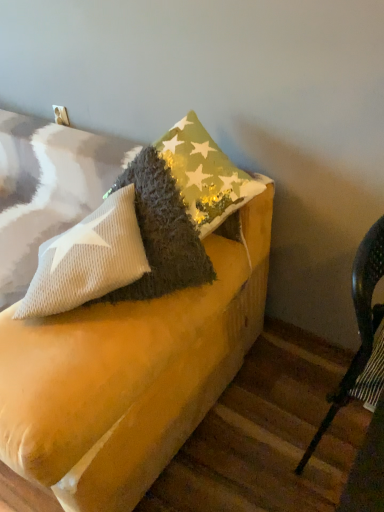
Question: In the image, is metallic dark green chair at right positioned in front of or behind velvet yellow couch at center?

Choices:
 (A) behind
 (B) front

Answer: (B)

Question: From the image's perspective, is metallic dark green chair at right located above or below velvet yellow couch at center?

Choices:
 (A) below
 (B) above

Answer: (A)

Question: Looking at their shapes, would you say metallic dark green chair at right is wider or thinner than velvet yellow couch at center?

Choices:
 (A) wide
 (B) thin

Answer: (B)

Question: Considering the relative positions of velvet yellow couch at center and metallic dark green chair at right in the image provided, is velvet yellow couch at center to the left or to the right of metallic dark green chair at right?

Choices:
 (A) right
 (B) left

Answer: (B)

Question: Is velvet yellow couch at center spatially inside metallic dark green chair at right, or outside of it?

Choices:
 (A) inside
 (B) outside

Answer: (B)

Question: From a real-world perspective, is velvet yellow couch at center above or below metallic dark green chair at right?

Choices:
 (A) above
 (B) below

Answer: (A)

Question: In terms of size, does velvet yellow couch at center appear bigger or smaller than metallic dark green chair at right?

Choices:
 (A) big
 (B) small

Answer: (A)